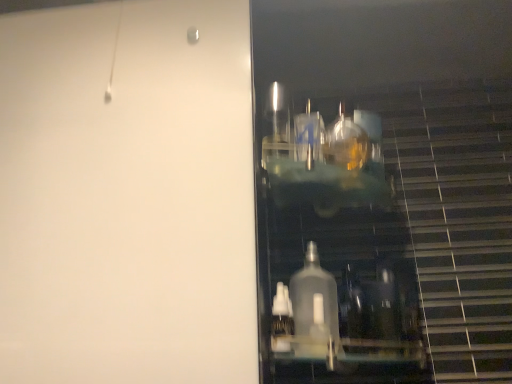
Describe the element at coordinates (127, 195) in the screenshot. I see `transparent glass door at right` at that location.

Locate an element on the screen. transparent glass door at right is located at coordinates (127, 195).

From the image's perspective, which one is positioned lower, transparent glass door at right or transparent plastic bottles at right?

transparent plastic bottles at right appears lower in the image.

Considering the relative sizes of transparent glass door at right and transparent plastic bottles at right in the image provided, is transparent glass door at right bigger than transparent plastic bottles at right?

Yes, transparent glass door at right is bigger than transparent plastic bottles at right.

Based on the photo, between transparent glass door at right and transparent plastic bottles at right, which one has less height?

transparent plastic bottles at right.

Would you say transparent glass door at right is to the left or to the right of transparent plastic bottles at right in the picture?

Clearly, transparent glass door at right is on the left of transparent plastic bottles at right in the image.

How distant is clear plastic bottle at lower center from transparent glass door at right?

clear plastic bottle at lower center is 13.01 inches from transparent glass door at right.

Considering the positions of points (281, 320) and (151, 334), is point (281, 320) closer to camera compared to point (151, 334)?

That is False.

Does clear plastic bottle at lower center turn towards transparent glass door at right?

No.

Does point (187, 203) come in front of point (288, 345)?

Yes, it is.

Looking at their sizes, would you say transparent glass door at right is wider or thinner than clear plastic bottle at lower center?

Considering their sizes, transparent glass door at right looks broader than clear plastic bottle at lower center.

From a real-world perspective, relative to clear plastic bottle at lower center, is transparent glass door at right vertically above or below?

In terms of real-world spatial position, transparent glass door at right is above clear plastic bottle at lower center.

In the image, is transparent glass door at right positioned in front of or behind clear plastic bottle at lower center?

In the image, transparent glass door at right appears in front of clear plastic bottle at lower center.

Measure the distance between clear plastic bottle at lower center and transparent plastic bottles at right.

→ 29.78 centimeters.

From a real-world perspective, is clear plastic bottle at lower center physically above transparent plastic bottles at right?

Incorrect, from a real-world perspective, clear plastic bottle at lower center is lower than transparent plastic bottles at right.

Can you confirm if clear plastic bottle at lower center is thinner than transparent plastic bottles at right?

Correct, the width of clear plastic bottle at lower center is less than that of transparent plastic bottles at right.

Is transparent plastic bottles at right smaller than clear plastic bottle at lower center?

No.

Considering the relative positions of transparent plastic bottles at right and clear plastic bottle at lower center in the image provided, is transparent plastic bottles at right in front of clear plastic bottle at lower center?

Yes, the depth of transparent plastic bottles at right is less than that of clear plastic bottle at lower center.

From a real-world perspective, which is physically above, transparent plastic bottles at right or clear plastic bottle at lower center?

transparent plastic bottles at right.

Would you say transparent plastic bottles at right is to the left or to the right of clear plastic bottle at lower center in the picture?

Based on their positions, transparent plastic bottles at right is located to the right of clear plastic bottle at lower center.

Which object is thinner, transparent plastic bottles at right or transparent glass door at right?

transparent plastic bottles at right is thinner.

Looking at this image, can you see transparent plastic bottles at right touching transparent glass door at right?

No, transparent plastic bottles at right is not touching transparent glass door at right.

Which point is more forward, (x=380, y=352) or (x=132, y=66)?

Point (x=132, y=66)

Identify the location of door above the transparent plastic bottles at right (from a real-world perspective). This screenshot has width=512, height=384. coord(127,195).

This screenshot has height=384, width=512. Identify the location of door above the clear plastic bottle at lower center (from the image's perspective). (127, 195).

Based on their spatial positions, is clear plastic bottle at lower center or transparent plastic bottles at right closer to transparent glass door at right?

Among the two, transparent plastic bottles at right is located nearer to transparent glass door at right.

Estimate the real-world distances between objects in this image. Which object is closer to transparent plastic bottles at right, clear plastic bottle at lower center or transparent glass door at right?

clear plastic bottle at lower center is positioned closer to the anchor transparent plastic bottles at right.

Looking at the image, which one is located further to transparent glass door at right, transparent plastic bottles at right or clear plastic bottle at lower center?

clear plastic bottle at lower center is further to transparent glass door at right.

Which object lies nearer to the anchor point transparent plastic bottles at right, transparent glass door at right or clear plastic bottle at lower center?

clear plastic bottle at lower center lies closer to transparent plastic bottles at right than the other object.

Estimate the real-world distances between objects in this image. Which object is closer to clear plastic bottle at lower center, transparent plastic bottles at right or transparent glass door at right?

Among the two, transparent plastic bottles at right is located nearer to clear plastic bottle at lower center.

Considering their positions, is transparent glass door at right positioned closer to clear plastic bottle at lower center than transparent plastic bottles at right?

Based on the image, transparent plastic bottles at right appears to be nearer to clear plastic bottle at lower center.

Locate an element on the screen. This screenshot has width=512, height=384. bottle situated between transparent glass door at right and transparent plastic bottles at right from left to right is located at coordinates (281, 319).